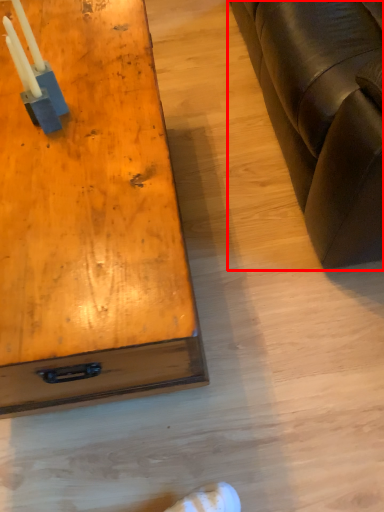
Question: Where is studio couch (annotated by the red box) located in relation to table in the image?

Choices:
 (A) right
 (B) left

Answer: (A)